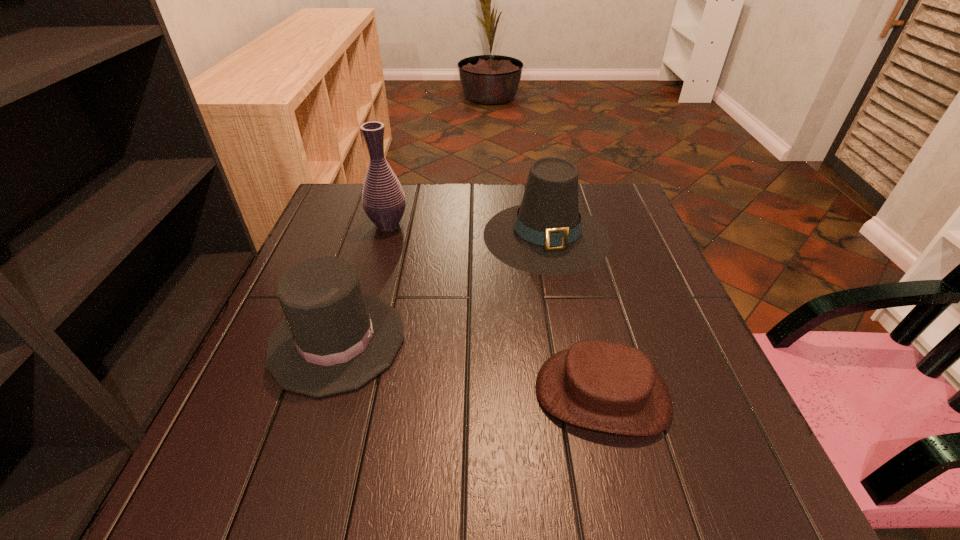
You are a GUI agent. You are given a task and a screenshot of the screen. Output one action in this format:
    pyautogui.click(x=<x>, y=<y>)
    Task: Click on the free space between the farthest hat and the tallest object
    
    Given the screenshot: What is the action you would take?
    pyautogui.click(x=468, y=230)

Identify which object is located as the third nearest to the shortest object. Please provide its 2D coordinates. Your answer should be formatted as a tuple, i.e. [(x, y)], where the tuple contains the x and y coordinates of a point satisfying the conditions above.

[(383, 199)]

Find the location of a particular element. This screenshot has width=960, height=540. the closest object to the farthest hat is located at coordinates (334, 339).

Select which hat is the second closest to the shortest hat. Please provide its 2D coordinates. Your answer should be formatted as a tuple, i.e. [(x, y)], where the tuple contains the x and y coordinates of a point satisfying the conditions above.

[(334, 339)]

Identify which hat is the third nearest to the tallest object. Please provide its 2D coordinates. Your answer should be formatted as a tuple, i.e. [(x, y)], where the tuple contains the x and y coordinates of a point satisfying the conditions above.

[(610, 387)]

The height and width of the screenshot is (540, 960). In order to click on free location that satisfies the following two spatial constraints: 1. on the front-facing side of the farthest hat; 2. on the front of the second tallest hat with the decoration in this screenshot , I will do `click(566, 341)`.

Locate an element on the screen. vacant region that satisfies the following two spatial constraints: 1. on the front of the second shortest hat with the decoration; 2. on the right side of the shortest object is located at coordinates (320, 394).

Identify the location of free space in the image that satisfies the following two spatial constraints: 1. on the front-facing side of the farthest hat; 2. on the left side of the shortest object. (577, 394).

Locate an element on the screen. This screenshot has height=540, width=960. vacant space that satisfies the following two spatial constraints: 1. on the front-facing side of the farthest hat; 2. on the front of the second shortest object with the decoration is located at coordinates (566, 341).

Where is `vacant area that satisfies the following two spatial constraints: 1. on the front-facing side of the farthest hat; 2. on the left side of the shortest object`? Image resolution: width=960 pixels, height=540 pixels. vacant area that satisfies the following two spatial constraints: 1. on the front-facing side of the farthest hat; 2. on the left side of the shortest object is located at coordinates (577, 394).